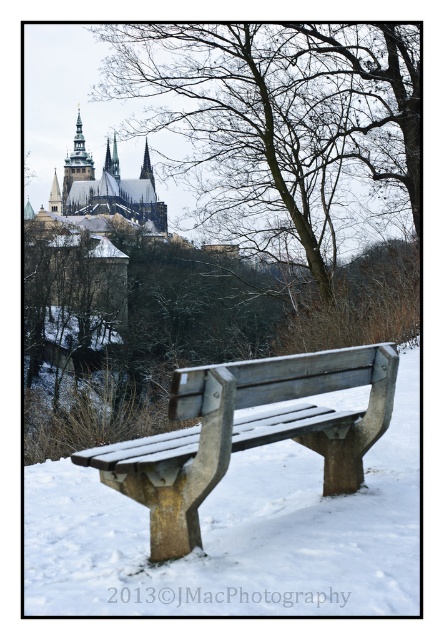
You are an architect analyzing the winter scene. You need to determine the exact location of the bare branches at upper center in the image. What are their coordinates?

The bare branches at upper center are located at coordinates point (280, 124).

Consider the image. You are standing in the winter scene and want to take a photo of the wooden bench at center with the castle in the background. However, the bare branches at upper center are blocking part of the view. Which direction should you move to get a clearer shot of the bench and the castle without the branches?

Move to the right side of the wooden bench at center. Since the bare branches at upper center are on the left side of the wooden bench at center, moving right would position you away from the branches, allowing a clearer view of the bench and the castle behind it.